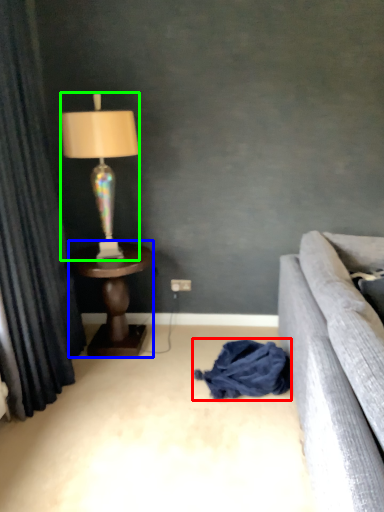
Question: Considering the real-world distances, which object is closest to material (highlighted by a red box)? table (highlighted by a blue box) or lamp (highlighted by a green box).

Choices:
 (A) table
 (B) lamp

Answer: (A)